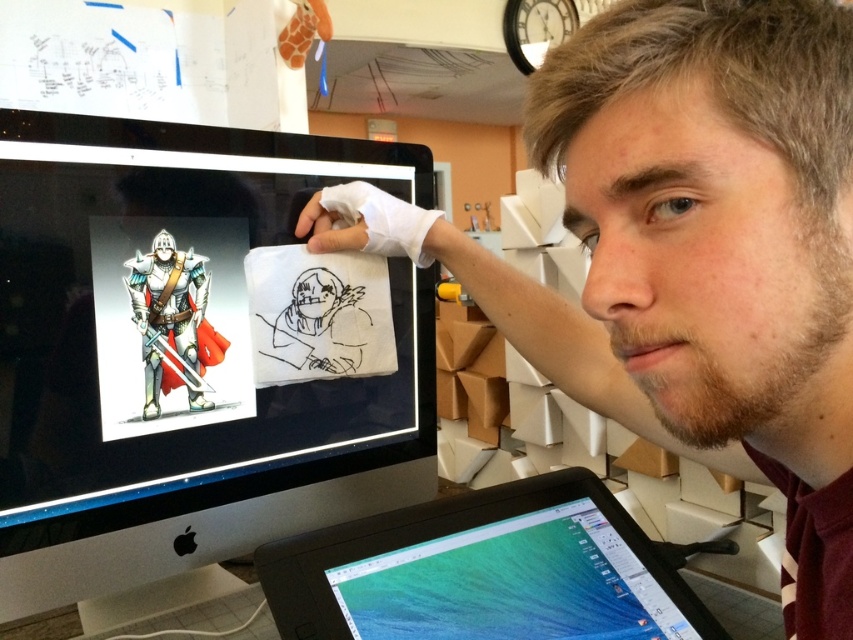
Question: Among these points, which one is farthest from the camera?

Choices:
 (A) (71, 572)
 (B) (509, 536)

Answer: (B)

Question: From the image, what is the correct spatial relationship of black glossy monitor at upper left in relation to black plastic tablet at lower center?

Choices:
 (A) right
 (B) left

Answer: (B)

Question: In this image, where is black glossy monitor at upper left located relative to black plastic tablet at lower center?

Choices:
 (A) right
 (B) left

Answer: (B)

Question: Can you confirm if black glossy monitor at upper left is bigger than black plastic tablet at lower center?

Choices:
 (A) no
 (B) yes

Answer: (B)